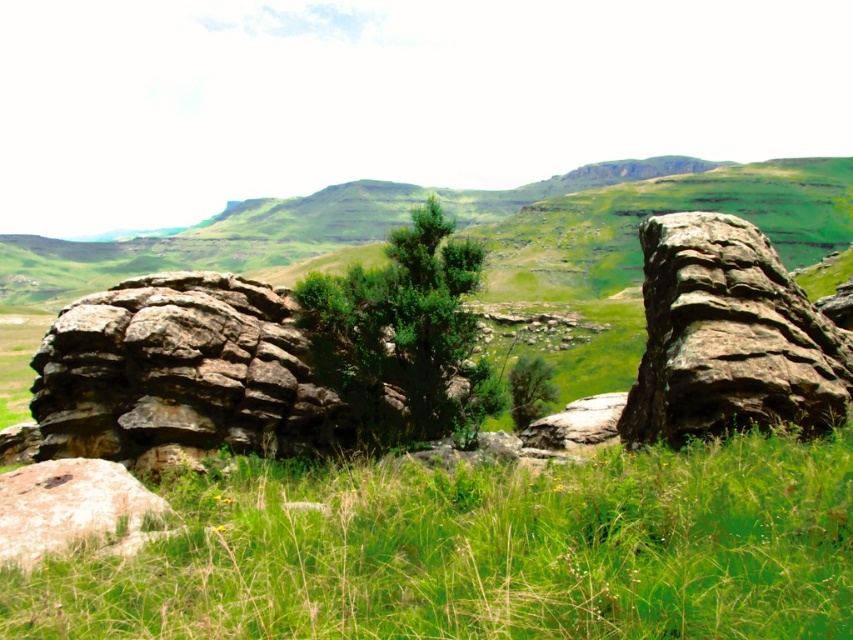
Image resolution: width=853 pixels, height=640 pixels. What are the coordinates of `green grassy at center` in the screenshot? It's located at (480, 552).

Where is `green grassy at center`? The image size is (853, 640). green grassy at center is located at coordinates (480, 552).

Can you confirm if rusty stone boulder at center-left is positioned above rusty stone boulder at right?

Actually, rusty stone boulder at center-left is below rusty stone boulder at right.

Which is more to the right, rusty stone boulder at center-left or rusty stone boulder at right?

From the viewer's perspective, rusty stone boulder at right appears more on the right side.

Where is `rusty stone boulder at center-left`? This screenshot has width=853, height=640. rusty stone boulder at center-left is located at coordinates (180, 374).

Is point (508, 586) behind point (256, 355)?

No.

Who is more distant from viewer, (780,536) or (236,310)?

The point (236,310) is behind.

Which is behind, point (718, 486) or point (283, 440)?

The point (283, 440) is behind.

Find the location of a particular element. green grassy at center is located at coordinates (480, 552).